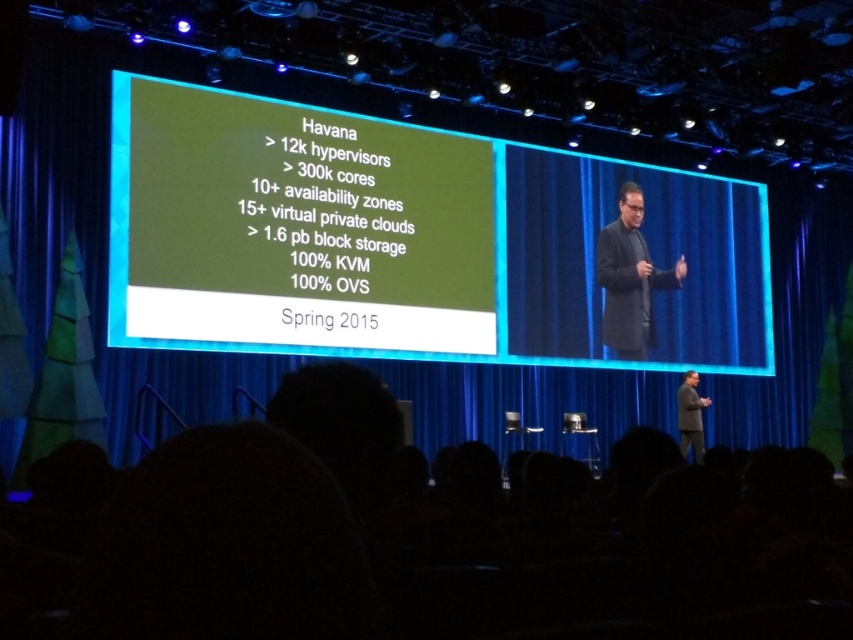
Based on the scene description, can you determine which object is placed above the other between the dark gray coat at center and the dark gray suit at center?

The dark gray coat at center is positioned over dark gray suit at center, so the coat is above the suit.

You are sitting in the audience watching the presentation slide. You notice two points on the slide labeled as point 1 and point 2. The first point is at coordinates (374, 262) and the second at (700, 429). Which point appears closer to you on the slide?

Point (374, 262) is closer to the viewer than point (700, 429) because it is positioned nearer in the spatial arrangement on the slide.

You are an event photographer at the front row. You want to take a photo of both the dark gray coat at center and the dark gray suit at center. Which one will appear larger in your photo?

The dark gray coat at center will appear larger in the photo because it is bigger than the dark gray suit at center.